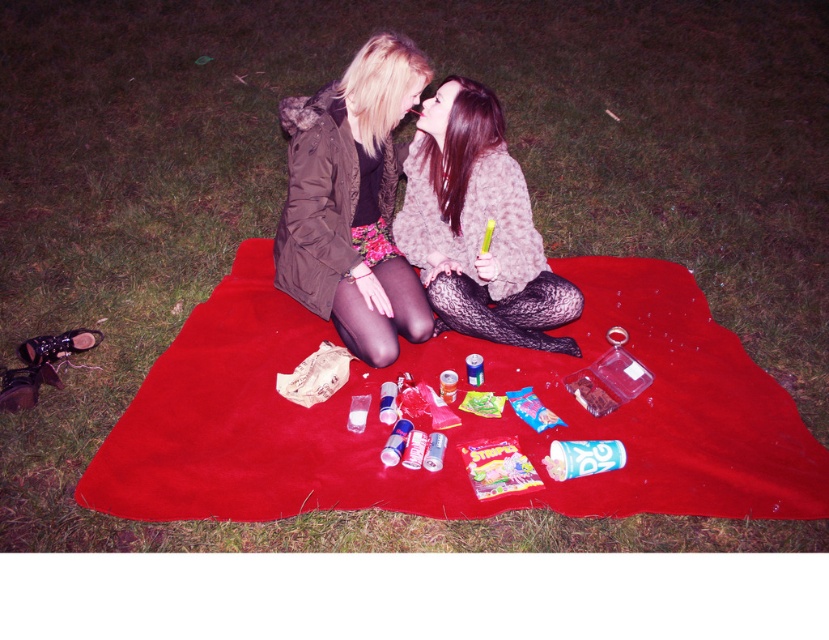
Question: Is fuzzy pink sweater at center in front of shiny gray sweater at center?

Choices:
 (A) yes
 (B) no

Answer: (B)

Question: Does red suede blanket at center appear on the right side of fuzzy pink sweater at center?

Choices:
 (A) yes
 (B) no

Answer: (B)

Question: Considering the relative positions of matte brown jacket at center and shiny gray sweater at center in the image provided, where is matte brown jacket at center located with respect to shiny gray sweater at center?

Choices:
 (A) right
 (B) left

Answer: (B)

Question: Based on their relative distances, which object is nearer to the fuzzy pink sweater at center?

Choices:
 (A) red suede blanket at center
 (B) matte brown jacket at center

Answer: (B)

Question: Which object appears closest to the camera in this image?

Choices:
 (A) fuzzy pink sweater at center
 (B) red suede blanket at center
 (C) matte brown jacket at center

Answer: (B)

Question: Which point appears closest to the camera in this image?

Choices:
 (A) (449, 198)
 (B) (177, 387)

Answer: (B)